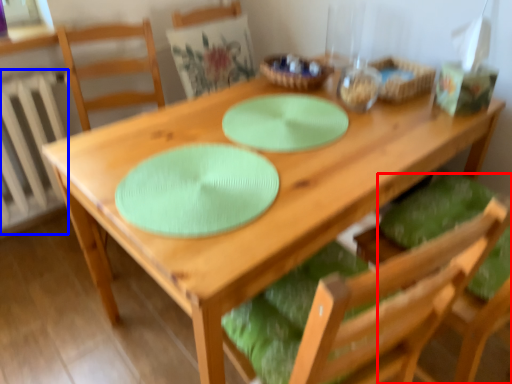
Question: Which of the following is the farthest to the observer, chair (highlighted by a red box) or radiator (highlighted by a blue box)?

Choices:
 (A) chair
 (B) radiator

Answer: (B)